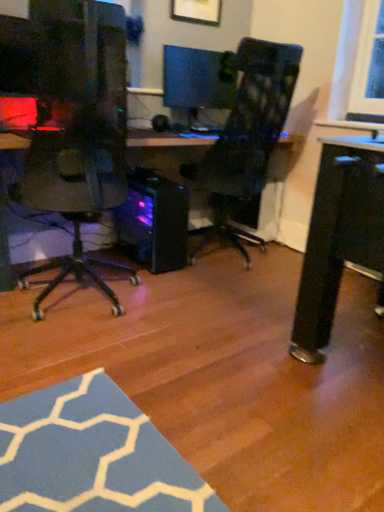
Question: From the image's perspective, is matte black monitor at center above or below transparent plastic computer tower at center?

Choices:
 (A) above
 (B) below

Answer: (A)

Question: In the image, is matte black monitor at center positioned in front of or behind transparent plastic computer tower at center?

Choices:
 (A) front
 (B) behind

Answer: (B)

Question: From their relative heights in the image, would you say matte black monitor at center is taller or shorter than transparent plastic computer tower at center?

Choices:
 (A) short
 (B) tall

Answer: (A)

Question: From a real-world perspective, is transparent plastic computer tower at center above or below matte black monitor at center?

Choices:
 (A) below
 (B) above

Answer: (A)

Question: Based on their positions, is transparent plastic computer tower at center located to the left or right of matte black monitor at center?

Choices:
 (A) right
 (B) left

Answer: (B)

Question: Is point (155, 245) positioned closer to the camera than point (173, 78)?

Choices:
 (A) farther
 (B) closer

Answer: (B)

Question: Considering their positions, is transparent plastic computer tower at center located in front of or behind matte black monitor at center?

Choices:
 (A) behind
 (B) front

Answer: (B)